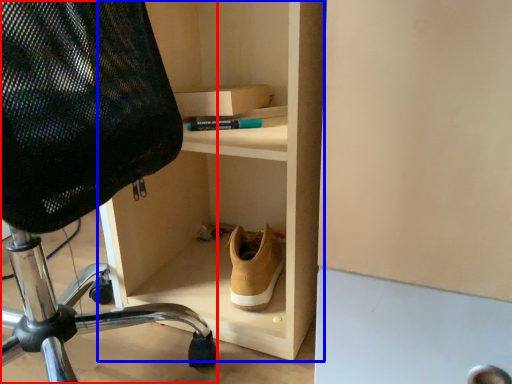
Question: Which point is closer to the camera, chair (highlighted by a red box) or shelf (highlighted by a blue box)?

Choices:
 (A) chair
 (B) shelf

Answer: (A)